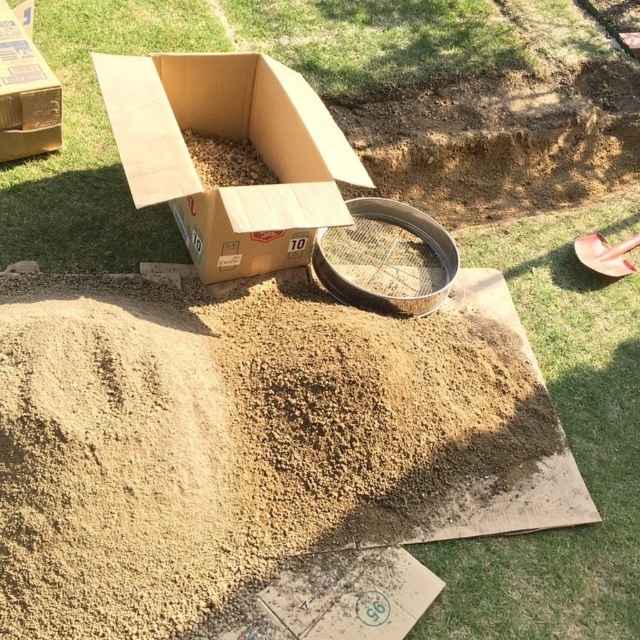
Question: Which point is farther from the camera taking this photo?

Choices:
 (A) (40, 128)
 (B) (218, 241)
 (C) (604, 252)
 (D) (336, 268)

Answer: (C)

Question: Is brown granular dirt at center below pink plastic shovel at lower right?

Choices:
 (A) yes
 (B) no

Answer: (A)

Question: Which point is farther to the camera?

Choices:
 (A) cardboard box at center
 (B) pink plastic shovel at lower right
 (C) brown granular dirt at center

Answer: (B)

Question: Does brown granular dirt at center have a larger size compared to pink plastic shovel at lower right?

Choices:
 (A) no
 (B) yes

Answer: (B)

Question: Does brown cardboard box at upper left appear over pink plastic shovel at lower right?

Choices:
 (A) yes
 (B) no

Answer: (A)

Question: Which of these objects is positioned closest to the cardboard box at center?

Choices:
 (A) pink plastic shovel at lower right
 (B) brown granular dirt at center
 (C) brown cardboard box at upper left
 (D) silver metallic sieve at center

Answer: (D)